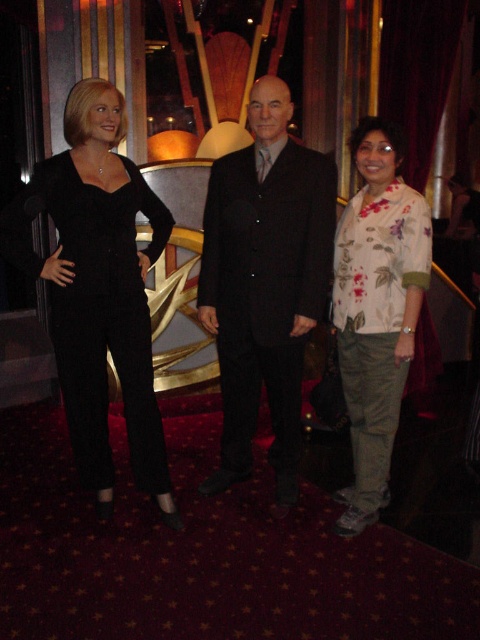
Question: Does black matte suit at center come behind black matte jumpsuit at left?

Choices:
 (A) yes
 (B) no

Answer: (A)

Question: Can you confirm if black matte suit at center is positioned below black matte jumpsuit at left?

Choices:
 (A) yes
 (B) no

Answer: (B)

Question: Which point appears farthest from the camera in this image?

Choices:
 (A) (264, 381)
 (B) (310, 148)
 (C) (404, 365)
 (D) (157, 225)

Answer: (D)

Question: Is black matte jumpsuit at left below matte black suit at center?

Choices:
 (A) yes
 (B) no

Answer: (A)

Question: Which point is farther from the camera taking this photo?

Choices:
 (A) (237, 186)
 (B) (123, 296)
 (C) (360, 330)

Answer: (A)

Question: Which object appears farthest from the camera in this image?

Choices:
 (A) floral print blouse at right
 (B) matte black suit at center
 (C) black matte suit at center
 (D) black matte jumpsuit at left

Answer: (B)